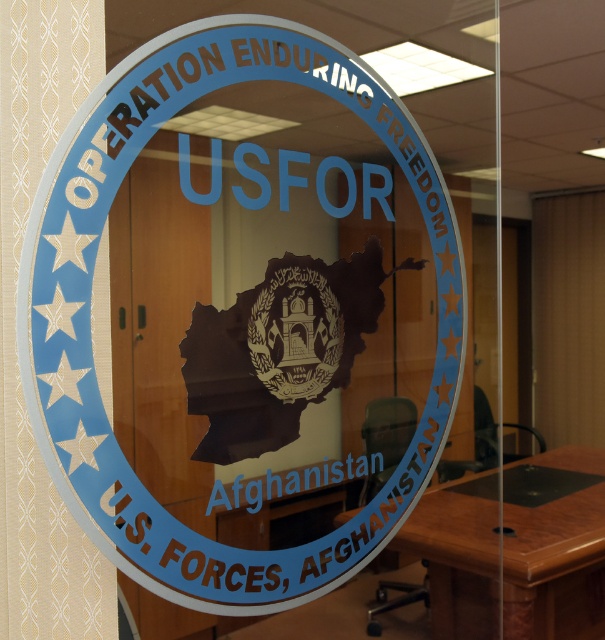
Between blue glossy sticker at center and brown textured emblem at center, which one is positioned higher?

blue glossy sticker at center

Locate an element on the screen. This screenshot has width=605, height=640. blue glossy sticker at center is located at coordinates (90, 326).

Image resolution: width=605 pixels, height=640 pixels. What do you see at coordinates (554, 548) in the screenshot? I see `brown wooden table at lower right` at bounding box center [554, 548].

Is brown wooden table at lower right bigger than brown textured emblem at center?

Yes.

Which is in front, point (578, 602) or point (358, 276)?

Positioned in front is point (358, 276).

Locate an element on the screen. This screenshot has width=605, height=640. brown wooden table at lower right is located at coordinates (554, 548).

From the picture: Who is more distant from viewer, (302,52) or (506,486)?

The point (506,486) is behind.

Does blue glossy sticker at center appear on the right side of brown wooden table at lower right?

In fact, blue glossy sticker at center is to the left of brown wooden table at lower right.

Where is `blue glossy sticker at center`? The height and width of the screenshot is (640, 605). blue glossy sticker at center is located at coordinates pos(90,326).